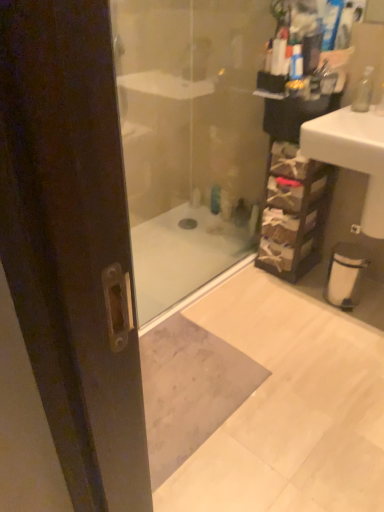
Question: Considering the relative sizes of clear glass soap dispenser at upper right and translucent plastic bottle at center in the image provided, is clear glass soap dispenser at upper right shorter than translucent plastic bottle at center?

Choices:
 (A) no
 (B) yes

Answer: (A)

Question: Does clear glass soap dispenser at upper right have a smaller size compared to translucent plastic bottle at center?

Choices:
 (A) no
 (B) yes

Answer: (A)

Question: Is translucent plastic bottle at center at the back of clear glass soap dispenser at upper right?

Choices:
 (A) no
 (B) yes

Answer: (A)

Question: Considering the relative sizes of clear glass soap dispenser at upper right and translucent plastic bottle at center in the image provided, is clear glass soap dispenser at upper right bigger than translucent plastic bottle at center?

Choices:
 (A) no
 (B) yes

Answer: (B)

Question: Can you confirm if clear glass soap dispenser at upper right is positioned to the right of translucent plastic bottle at center?

Choices:
 (A) no
 (B) yes

Answer: (B)

Question: From a real-world perspective, relative to brown woven basket at right, is white glossy sink at right vertically above or below?

Choices:
 (A) above
 (B) below

Answer: (A)

Question: Does point (337, 136) appear closer or farther from the camera than point (283, 261)?

Choices:
 (A) closer
 (B) farther

Answer: (A)

Question: From their relative heights in the image, would you say white glossy sink at right is taller or shorter than brown woven basket at right?

Choices:
 (A) tall
 (B) short

Answer: (B)

Question: Looking at their shapes, would you say white glossy sink at right is wider or thinner than brown woven basket at right?

Choices:
 (A) thin
 (B) wide

Answer: (B)

Question: From a real-world perspective, is translucent plastic bottle at center physically located above or below brown woven basket at right?

Choices:
 (A) below
 (B) above

Answer: (A)

Question: Is translucent plastic bottle at center inside the boundaries of brown woven basket at right, or outside?

Choices:
 (A) inside
 (B) outside

Answer: (B)

Question: From the image's perspective, is translucent plastic bottle at center above or below brown woven basket at right?

Choices:
 (A) below
 (B) above

Answer: (B)

Question: Considering the positions of point (218, 203) and point (321, 176), is point (218, 203) closer or farther from the camera than point (321, 176)?

Choices:
 (A) farther
 (B) closer

Answer: (A)

Question: Do you think transparent glass shower door at center is within clear glass soap dispenser at upper right, or outside of it?

Choices:
 (A) inside
 (B) outside

Answer: (B)

Question: Relative to clear glass soap dispenser at upper right, is transparent glass shower door at center in front or behind?

Choices:
 (A) front
 (B) behind

Answer: (A)